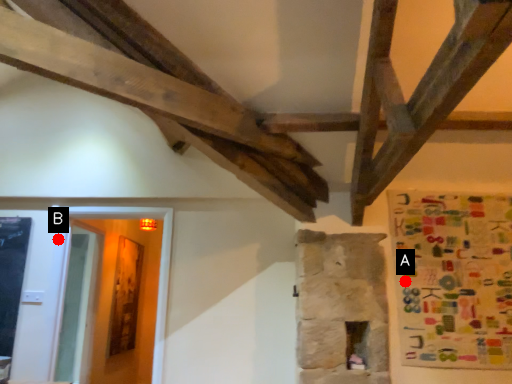
Question: Two points are circled on the image, labeled by A and B beside each circle. Which point is further to the camera?

Choices:
 (A) A is further
 (B) B is further

Answer: (B)